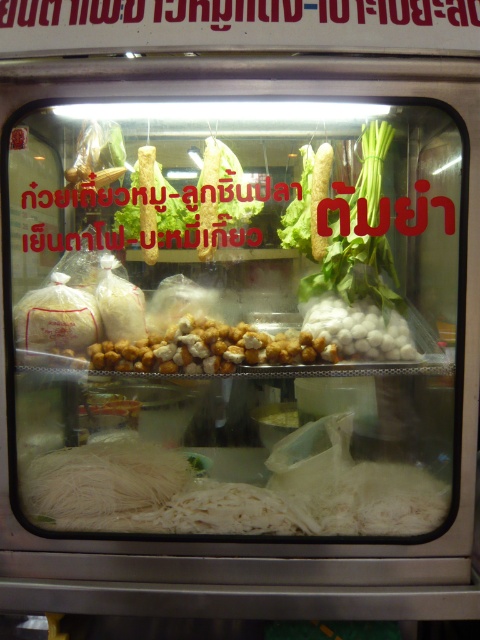
Between golden crispy balls at center and white glossy balls at center, which one is positioned lower?

golden crispy balls at center is lower down.

Find the location of a particular element. golden crispy balls at center is located at coordinates (208, 348).

Locate an element on the screen. The height and width of the screenshot is (640, 480). golden crispy balls at center is located at coordinates (208, 348).

Which of these two, golden crispy balls at center or green leafy vegetable at right, stands taller?

green leafy vegetable at right is taller.

Can you confirm if golden crispy balls at center is positioned above green leafy vegetable at right?

No.

Between point (172, 339) and point (342, 266), which one is positioned behind?

The point (342, 266) is behind.

In order to click on golden crispy balls at center in this screenshot , I will do `click(208, 348)`.

Is green leafy vegetable at right positioned before white glossy balls at center?

That is True.

Consider the image. Between green leafy vegetable at right and white glossy balls at center, which one appears on the right side from the viewer's perspective?

green leafy vegetable at right

Identify the location of green leafy vegetable at right. This screenshot has width=480, height=640. (360, 236).